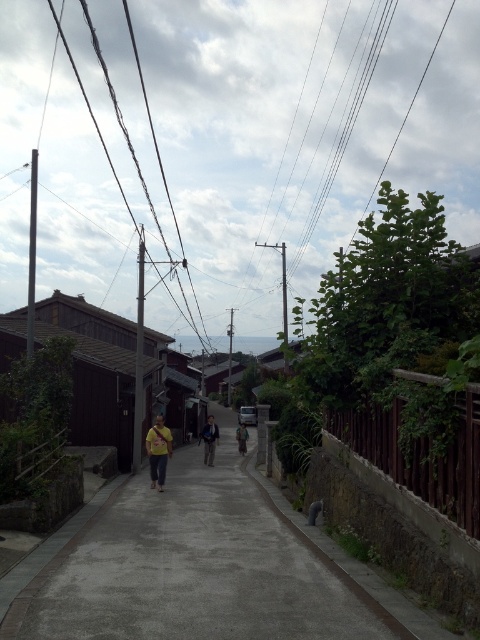
Does black wire at upper center have a lesser height compared to yellow fabric shirt at center?

No, black wire at upper center is not shorter than yellow fabric shirt at center.

Can you confirm if black wire at upper center is smaller than yellow fabric shirt at center?

No.

Between point (75, 74) and point (212, 451), which one is positioned behind?

The point (75, 74) is behind.

Identify the location of black wire at upper center. This screenshot has height=640, width=480. (92, 113).

Which is below, yellow fabric bag at center or yellow fabric shirt at center?

Positioned lower is yellow fabric shirt at center.

Is point (152, 436) farther from camera compared to point (217, 436)?

No, (152, 436) is closer to viewer.

Between point (162, 470) and point (214, 435), which one is positioned behind?

The point (214, 435) is behind.

Find the location of a particular element. The image size is (480, 640). yellow fabric bag at center is located at coordinates (157, 451).

Between point (127, 202) and point (242, 435), which one is positioned behind?

Positioned behind is point (127, 202).

How far apart are black wire at upper center and yellow fabric at center?

black wire at upper center and yellow fabric at center are 58.07 meters apart from each other.

Locate an element on the screen. black wire at upper center is located at coordinates (92, 113).

At what (x,y) coordinates should I click in order to perform the action: click on black wire at upper center. Please return your answer as a coordinate pair (x, y). The height and width of the screenshot is (640, 480). Looking at the image, I should click on (92, 113).